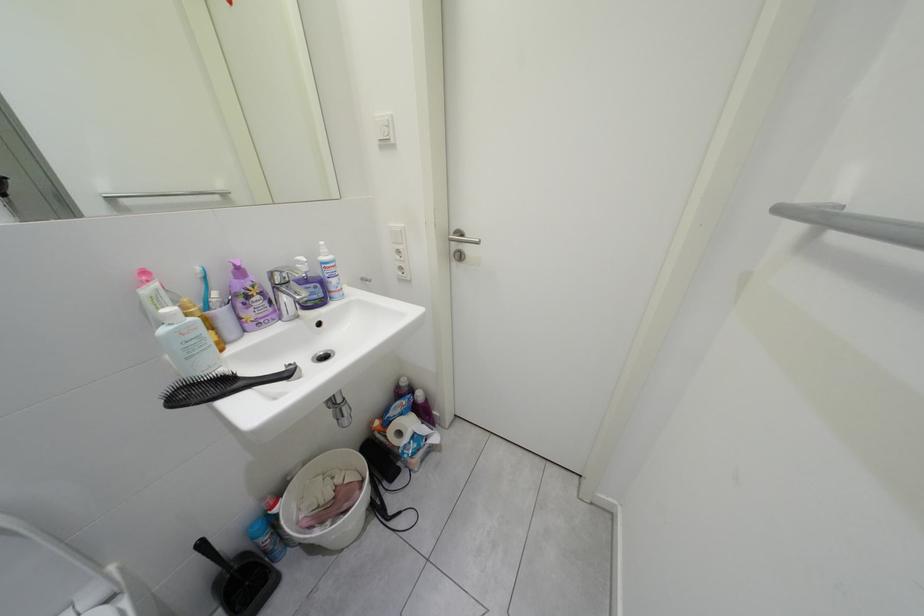
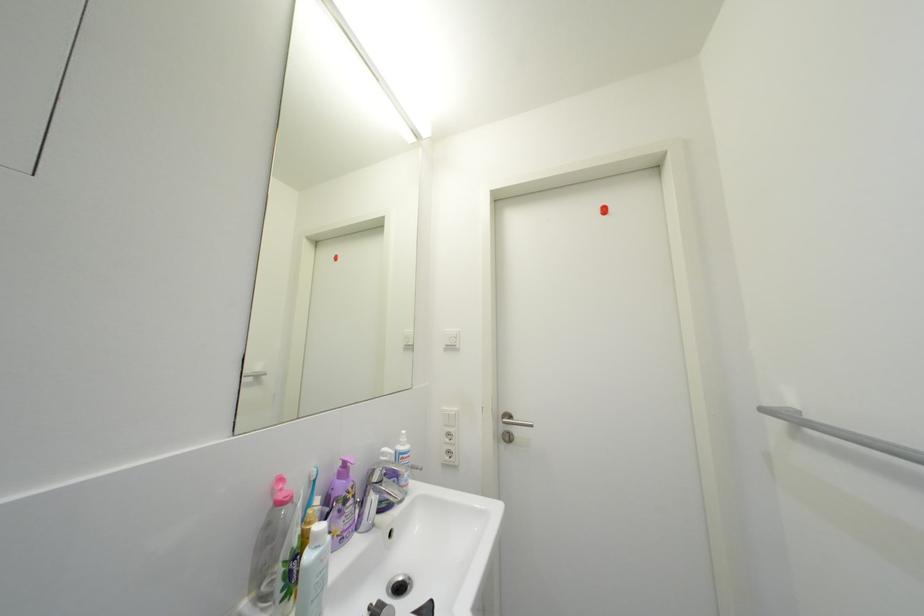
Question: The first image is from the beginning of the video and the second image is from the end. How did the camera likely rotate when shooting the video?

Choices:
 (A) Left
 (B) Right
 (C) Up
 (D) Down

Answer: (C)